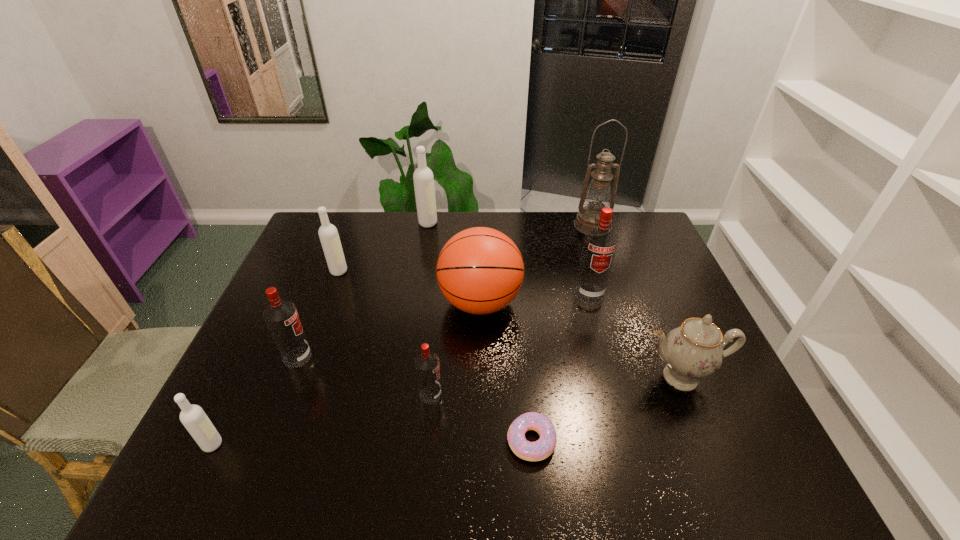
I want to click on doughnut located in the near edge section of the desktop, so click(539, 450).

The height and width of the screenshot is (540, 960). Find the location of `oil lamp that is at the right edge`. oil lamp that is at the right edge is located at coordinates (598, 195).

This screenshot has width=960, height=540. I want to click on chinaware situated at the right edge, so click(x=693, y=351).

The height and width of the screenshot is (540, 960). In order to click on object at the near left corner in this screenshot , I will do `click(194, 419)`.

This screenshot has height=540, width=960. Find the location of `object that is at the far right corner`. object that is at the far right corner is located at coordinates click(598, 195).

In the image, there is a desktop. Where is `vacant area at the far edge`? The image size is (960, 540). vacant area at the far edge is located at coordinates (545, 229).

The image size is (960, 540). Find the location of `blank space at the near edge of the desktop`. blank space at the near edge of the desktop is located at coordinates (660, 453).

Find the location of a particular element. The image size is (960, 540). free space at the left edge of the desktop is located at coordinates (297, 300).

Locate an element on the screen. This screenshot has width=960, height=540. blank space at the right edge is located at coordinates (727, 382).

Image resolution: width=960 pixels, height=540 pixels. In order to click on vacant space at the near left corner of the desktop in this screenshot , I will do pos(201,480).